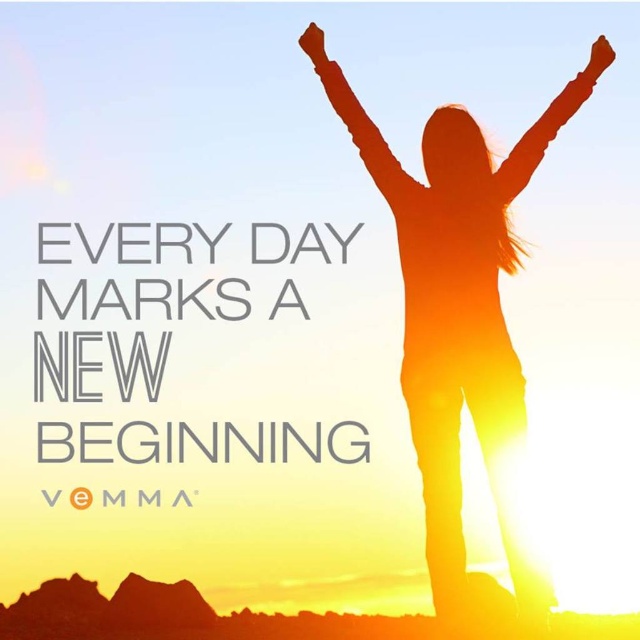
Question: Which object is positioned farthest from the orange matte arm at upper center?

Choices:
 (A) silhouette arm at upper center
 (B) matte orange hand at upper right
 (C) silhouette figure at center
 (D) matte brown hand at upper center

Answer: (B)

Question: Is silhouette arm at upper center below matte orange hand at upper right?

Choices:
 (A) no
 (B) yes

Answer: (B)

Question: Is silhouette figure at center bigger than matte brown hand at upper center?

Choices:
 (A) yes
 (B) no

Answer: (A)

Question: Which of these objects is positioned farthest from the matte brown hand at upper center?

Choices:
 (A) silhouette arm at upper center
 (B) orange matte arm at upper center

Answer: (A)

Question: Estimate the real-world distances between objects in this image. Which object is closer to the orange matte arm at upper center?

Choices:
 (A) matte orange hand at upper right
 (B) silhouette arm at upper center
 (C) matte brown hand at upper center

Answer: (C)

Question: Does orange matte arm at upper center appear under matte orange hand at upper right?

Choices:
 (A) no
 (B) yes

Answer: (B)